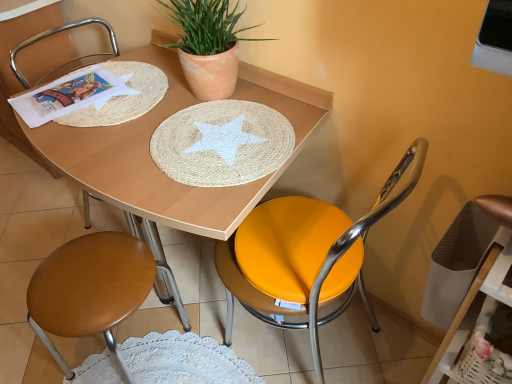
This screenshot has height=384, width=512. Identify the location of vacant region under metallic yellow seat at center, which ranks as the third chair in left-to-right order (from a real-world perspective). point(318,352).